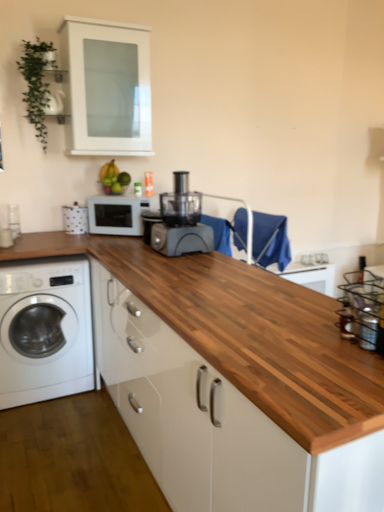
Locate an element on the screen. vacant space that is in between matte black food processor at center and clear glass bottle at right is located at coordinates (238, 286).